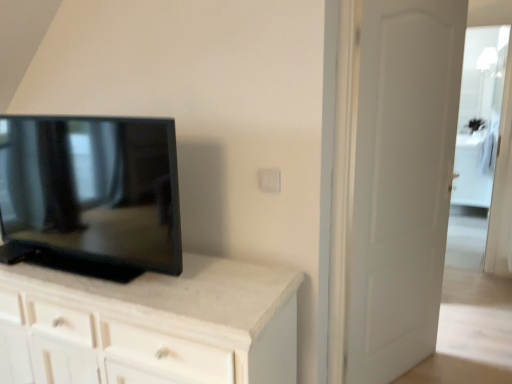
Question: Does transparent glass door at right have a lesser height compared to matte black tv at left?

Choices:
 (A) yes
 (B) no

Answer: (B)

Question: Considering the relative sizes of transparent glass door at right and matte black tv at left in the image provided, is transparent glass door at right taller than matte black tv at left?

Choices:
 (A) yes
 (B) no

Answer: (A)

Question: Can you confirm if transparent glass door at right is bigger than matte black tv at left?

Choices:
 (A) yes
 (B) no

Answer: (B)

Question: From a real-world perspective, is transparent glass door at right on top of matte black tv at left?

Choices:
 (A) no
 (B) yes

Answer: (A)

Question: From the image's perspective, does transparent glass door at right appear lower than matte black tv at left?

Choices:
 (A) yes
 (B) no

Answer: (B)

Question: Is point (118, 240) closer or farther from the camera than point (479, 59)?

Choices:
 (A) farther
 (B) closer

Answer: (B)

Question: In terms of size, does matte black tv at left appear bigger or smaller than transparent glass door at right?

Choices:
 (A) small
 (B) big

Answer: (B)

Question: From the image's perspective, is matte black tv at left located above or below transparent glass door at right?

Choices:
 (A) below
 (B) above

Answer: (A)

Question: In terms of width, does matte black tv at left look wider or thinner when compared to transparent glass door at right?

Choices:
 (A) wide
 (B) thin

Answer: (A)

Question: Would you say white matte door at right is to the left or to the right of matte black tv at left in the picture?

Choices:
 (A) right
 (B) left

Answer: (A)

Question: Choose the correct answer: Is white matte door at right inside matte black tv at left or outside it?

Choices:
 (A) outside
 (B) inside

Answer: (A)

Question: From the image's perspective, is white matte door at right positioned above or below matte black tv at left?

Choices:
 (A) above
 (B) below

Answer: (B)

Question: Is white matte door at right in front of or behind matte black tv at left in the image?

Choices:
 (A) behind
 (B) front

Answer: (A)

Question: Is transparent glass door at right inside the boundaries of white matte door at right, or outside?

Choices:
 (A) inside
 (B) outside

Answer: (B)

Question: Based on their positions, is transparent glass door at right located to the left or right of white matte door at right?

Choices:
 (A) left
 (B) right

Answer: (B)